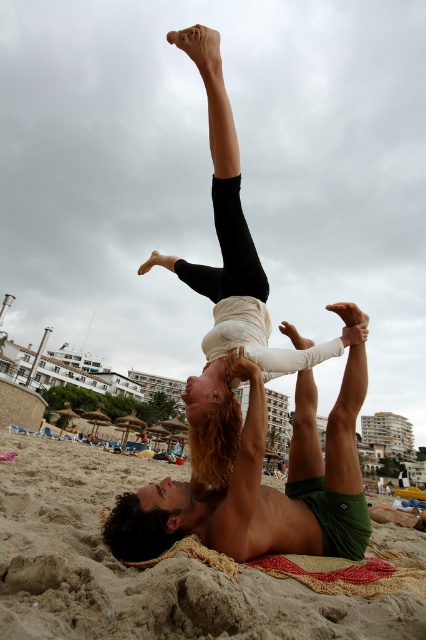
You are a photographer trying to capture the perfect shot of the acrobats. You notice the white cotton shirt at center and the green shorts at center. Which piece of clothing should you focus on first if you want to capture the larger object in the frame?

The white cotton shirt at center is larger in size than the green shorts at center, so you should focus on the white cotton shirt at center first to capture the larger object in the frame.

You are standing at the point marked as point (249, 400). Which object are you standing on?

You are standing on the white cotton shirt at center.